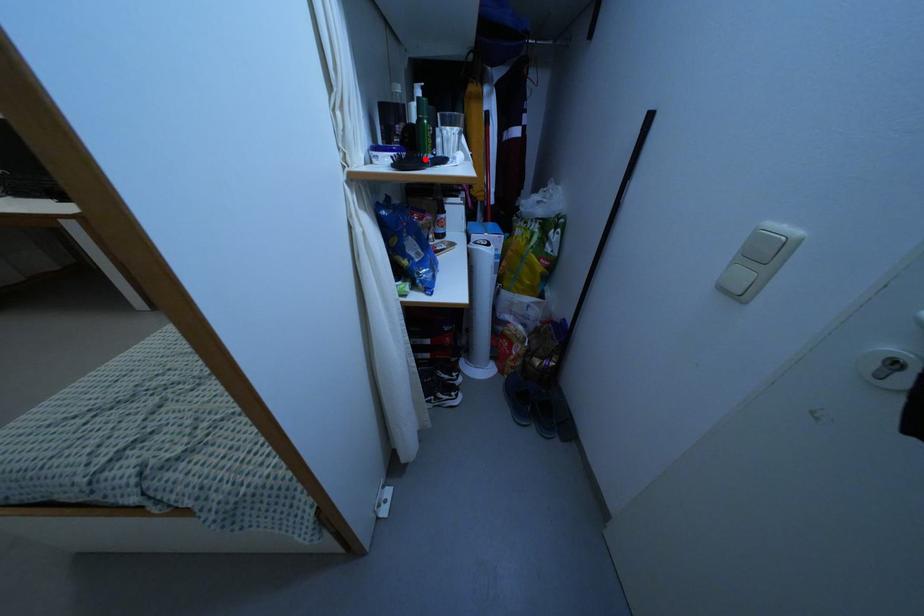
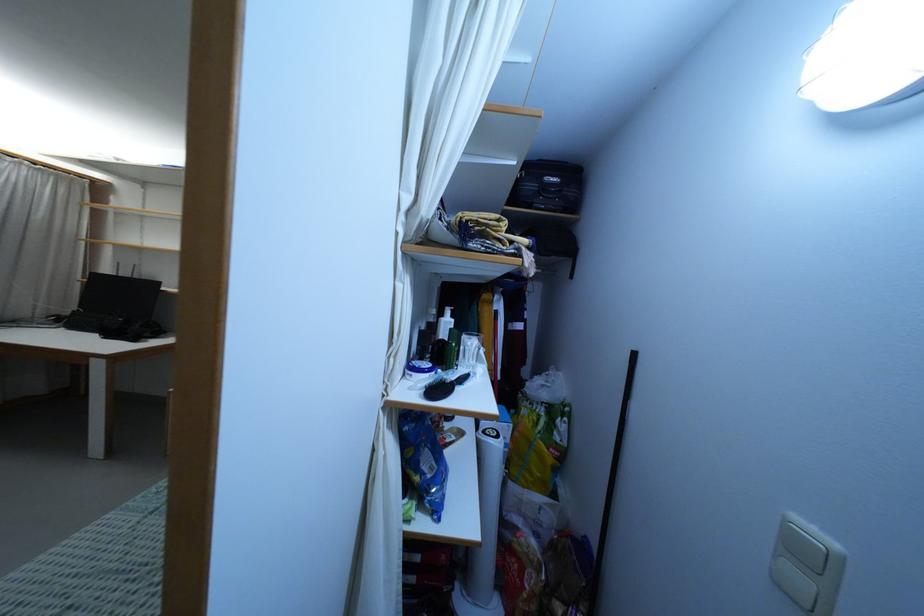
Find the pixel in the second image that matches the highlighted location in the first image.

(452, 382)